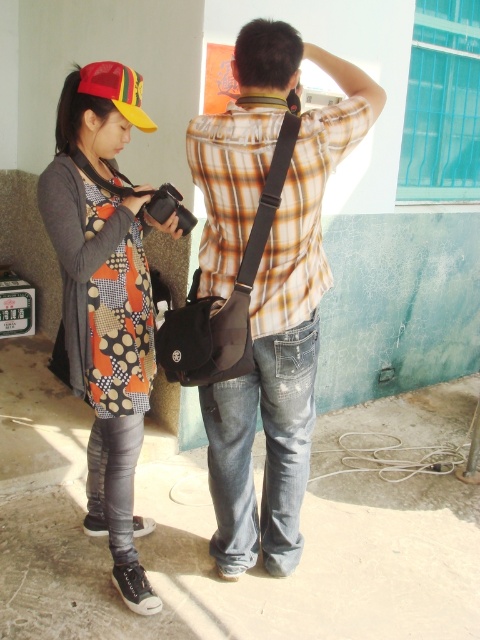
You are a photographer trying to position two markers in a scene. The first marker should be placed at point (301, 369) and the second at point (119, 76). Which marker is closer to the camera?

Point (301, 369) is further to the viewer than point (119, 76), so the second marker at point (119, 76) is closer to the camera.

You are a photographer trying to frame a shot that includes both the plaid shirt at center and the matte yellow baseball cap at upper left. Which object should you adjust to ensure both fit in the frame?

Since the plaid shirt at center is wider than the matte yellow baseball cap at upper left, you should adjust the angle or zoom to accommodate the width of the plaid shirt at center so both objects fit in the frame.

You are standing at the origin point of the coordinate system. You see two points in the image, point (324, 125) and point (124, 557). Which point is closer to you?

Point (324, 125) is in front of point (124, 557), so it is closer to you.